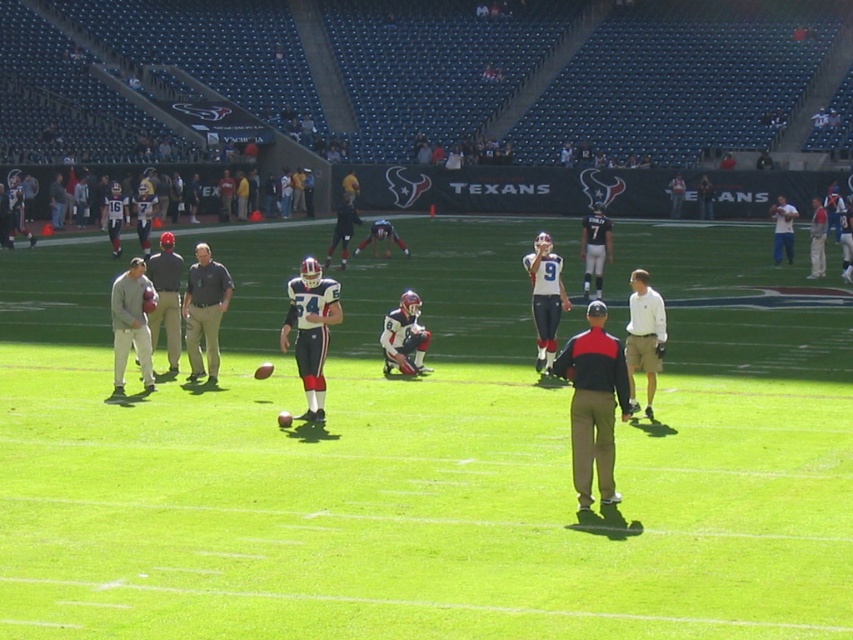
In the scene shown: You are a photographer standing at the edge of the field. You want to capture a photo that includes both the green grass field at center and the gray fabric jacket at center. Which object should you frame first to ensure both are fully visible in the photo?

The green grass field at center has a larger width than the gray fabric jacket at center, so you should frame the green grass field at center first to ensure both are fully visible in the photo.

You are standing on the field during the football practice. You notice two points marked on the field at coordinates point [457,492] and point [172,237]. Which point is closer to your current position?

Point [457,492] is closer to the viewer than point [172,237].

You are a photographer standing in the middle of the field. You need to take a photo of both the gray cotton sweatshirt at left and the gray fabric jacket at right. Which object should you focus on first if you want to capture both in the same frame without moving the camera?

The gray cotton sweatshirt at left is shorter than the gray fabric jacket at right. Therefore, you should focus on the gray cotton sweatshirt at left first to ensure it is in the foreground and the taller jacket at right is still within the frame.